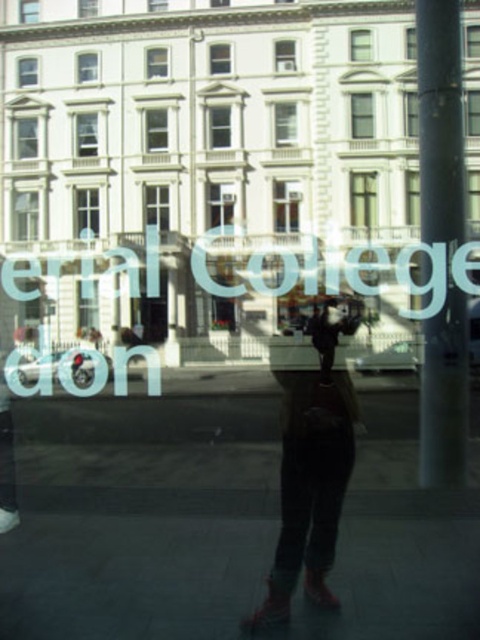
Can you confirm if smooth concrete pavement at lower center is positioned below matte black boots at center?

Indeed, smooth concrete pavement at lower center is positioned under matte black boots at center.

Who is lower down, smooth concrete pavement at lower center or matte black boots at center?

smooth concrete pavement at lower center

Looking at this image, who is more distant from viewer, (118,608) or (359,321)?

The point (359,321) is behind.

Locate an element on the screen. The height and width of the screenshot is (640, 480). smooth concrete pavement at lower center is located at coordinates (132, 577).

Between smooth metallic pole at right and matte black boots at center, which one is positioned higher?

smooth metallic pole at right

Is point (454, 108) positioned after point (310, 560)?

Yes, it is behind point (310, 560).

Who is more distant from viewer, (454, 6) or (291, 452)?

Point (291, 452)

This screenshot has height=640, width=480. In order to click on smooth metallic pole at right in this screenshot , I will do `click(440, 122)`.

Which is below, smooth concrete pavement at lower center or smooth metallic pole at right?

smooth concrete pavement at lower center is lower down.

Can you confirm if smooth concrete pavement at lower center is taller than smooth metallic pole at right?

No.

Describe the element at coordinates (132, 577) in the screenshot. Image resolution: width=480 pixels, height=640 pixels. I see `smooth concrete pavement at lower center` at that location.

Where is `smooth concrete pavement at lower center`? This screenshot has width=480, height=640. smooth concrete pavement at lower center is located at coordinates (132, 577).